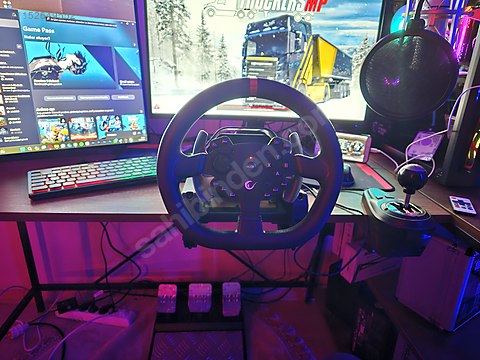
The width and height of the screenshot is (480, 360). I want to click on left monitor, so click(x=99, y=71).